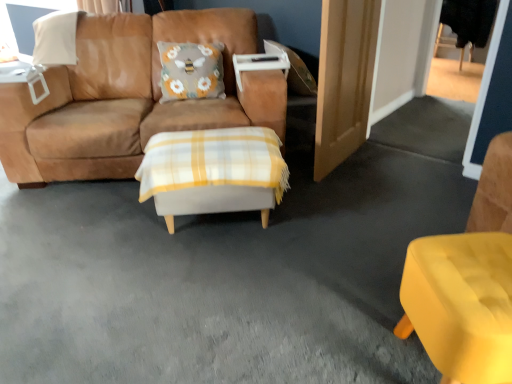
Locate an element on the screen. empty space that is ontop of matte yellow chair at lower right is located at coordinates (476, 278).